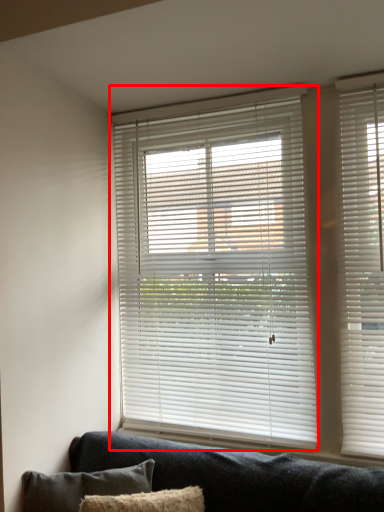
Question: From the image's perspective, where is window blind (annotated by the red box) located in relation to pillow in the image?

Choices:
 (A) above
 (B) below

Answer: (A)